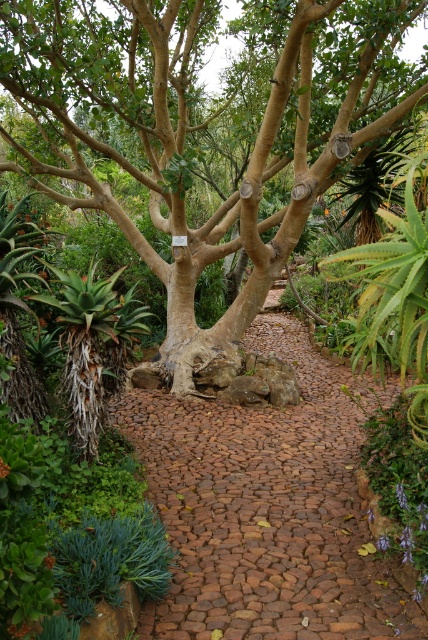
Question: Considering the relative positions of brown textured tree at center and brown cobblestone path at center in the image provided, where is brown textured tree at center located with respect to brown cobblestone path at center?

Choices:
 (A) right
 (B) left

Answer: (A)

Question: Which of the following is the closest to the observer?

Choices:
 (A) (222, 531)
 (B) (162, 157)

Answer: (A)

Question: Which point is closer to the camera?

Choices:
 (A) (184, 481)
 (B) (321, 90)

Answer: (A)

Question: Can you confirm if brown textured tree at center is positioned below brown cobblestone path at center?

Choices:
 (A) yes
 (B) no

Answer: (B)

Question: Considering the relative positions of brown textured tree at center and brown cobblestone path at center in the image provided, where is brown textured tree at center located with respect to brown cobblestone path at center?

Choices:
 (A) right
 (B) left

Answer: (A)

Question: Which of the following is the farthest from the observer?

Choices:
 (A) coord(261,282)
 (B) coord(187,435)

Answer: (A)